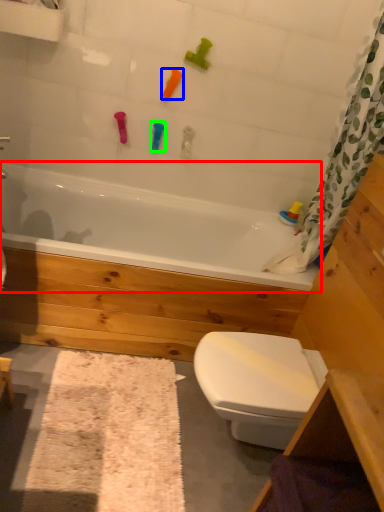
Question: Which object is positioned closest to bathtub (highlighted by a red box)? Select from toy (highlighted by a blue box) and toy (highlighted by a green box).

Choices:
 (A) toy
 (B) toy

Answer: (B)